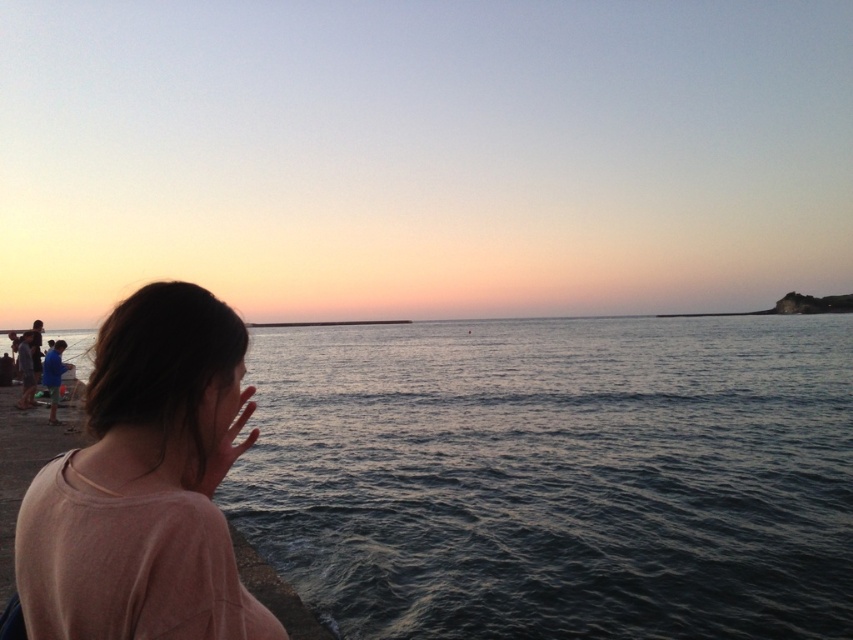
You are standing at the edge of the scene and want to walk towards the smooth water at center without getting your pink cotton shirt at lower left wet. Which direction should you move?

The smooth water at center is positioned under the pink cotton shirt at lower left, so you should move away from the pink cotton shirt at lower left to avoid getting it wet.

You are standing at the edge of the scene and want to walk towards the smooth water at center. However, there is a pink cotton shirt at lower left in your path. Can you reach the water without stepping on the shirt?

The smooth water at center is further to the viewer than the pink cotton shirt at lower left, so you can walk around the pink cotton shirt at lower left to reach the smooth water at center without stepping on it.

You are a photographer planning to capture the scene of the smooth water at center and the pink cotton shirt at lower left. Which object should you focus on first if you want to include both in a single frame without moving the camera?

The smooth water at center is bigger than the pink cotton shirt at lower left, so you should focus on the smooth water at center first to ensure it fits properly in the frame before adjusting for the smaller pink cotton shirt at lower left.